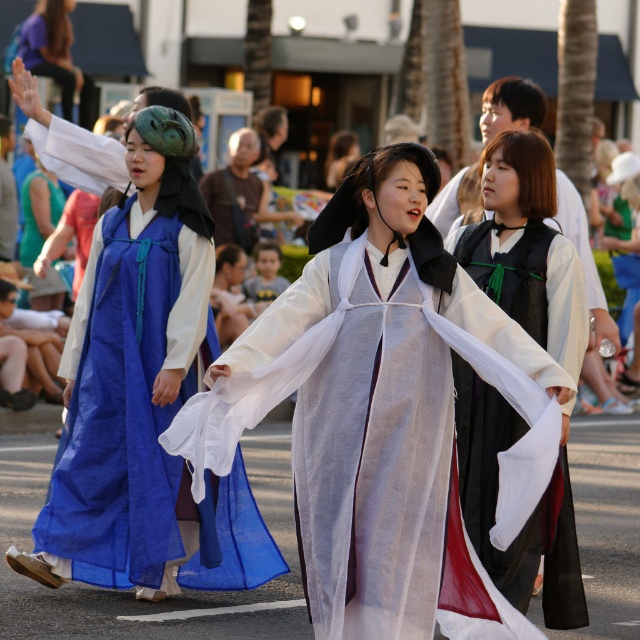
Question: Which of the following is the farthest from the observer?

Choices:
 (A) silky white robe at center
 (B) blue silk dress at center

Answer: (B)

Question: Which object is farther from the camera taking this photo?

Choices:
 (A) black satin robe at center
 (B) silky white robe at center
 (C) light blue fabric at center
 (D) blue silk dress at center

Answer: (C)

Question: Considering the relative positions of silky white robe at center and light blue fabric at center in the image provided, where is silky white robe at center located with respect to light blue fabric at center?

Choices:
 (A) right
 (B) left

Answer: (A)

Question: Can you confirm if blue silk dress at center is bigger than black satin robe at center?

Choices:
 (A) no
 (B) yes

Answer: (B)

Question: Is blue silk dress at center positioned at the back of light blue fabric at center?

Choices:
 (A) yes
 (B) no

Answer: (B)

Question: Among these points, which one is farthest from the camera?

Choices:
 (A) (140, 264)
 (B) (493, 436)

Answer: (A)